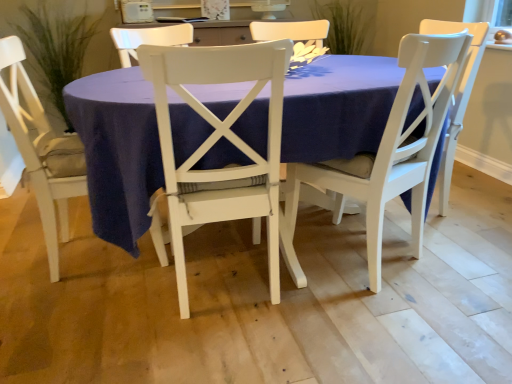
Question: Based on their positions, is white painted wood chair at lower left, marked as the 3th chair in a right-to-left arrangement, located to the left or right of matte white table at center?

Choices:
 (A) left
 (B) right

Answer: (A)

Question: Choose the correct answer: Is white painted wood chair at lower left, positioned as the first chair in left-to-right order, inside matte white table at center or outside it?

Choices:
 (A) inside
 (B) outside

Answer: (A)

Question: Estimate the real-world distances between objects in this image. Which object is closer to the green leafy plant at upper center, which is the 1th plant in right-to-left order?

Choices:
 (A) white wood chair at center, the 2th chair positioned from the right
 (B) white wood chair at center, the 3th chair viewed from the left
 (C) white painted wood chair at lower left, marked as the 3th chair in a right-to-left arrangement
 (D) matte white table at center
 (E) green leafy plant at left, the 1th plant from the left

Answer: (E)

Question: Estimate the real-world distances between objects in this image. Which object is farther from the white wood chair at center, the 3th chair viewed from the left?

Choices:
 (A) matte white table at center
 (B) white wood chair at center, the 2th chair positioned from the right
 (C) white painted wood chair at lower left, marked as the 3th chair in a right-to-left arrangement
 (D) green leafy plant at upper center, which is the second plant in left-to-right order
 (E) green leafy plant at left, the 1th plant from the left

Answer: (E)